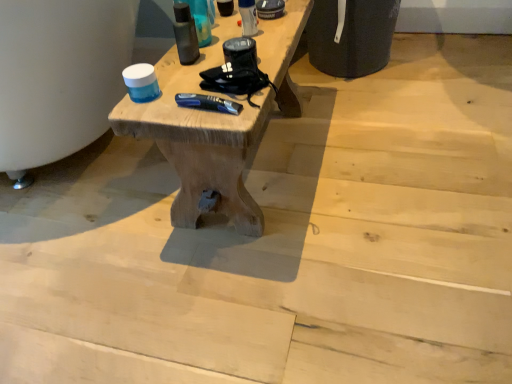
Identify the location of free location to the right of wooden table at center. (393, 147).